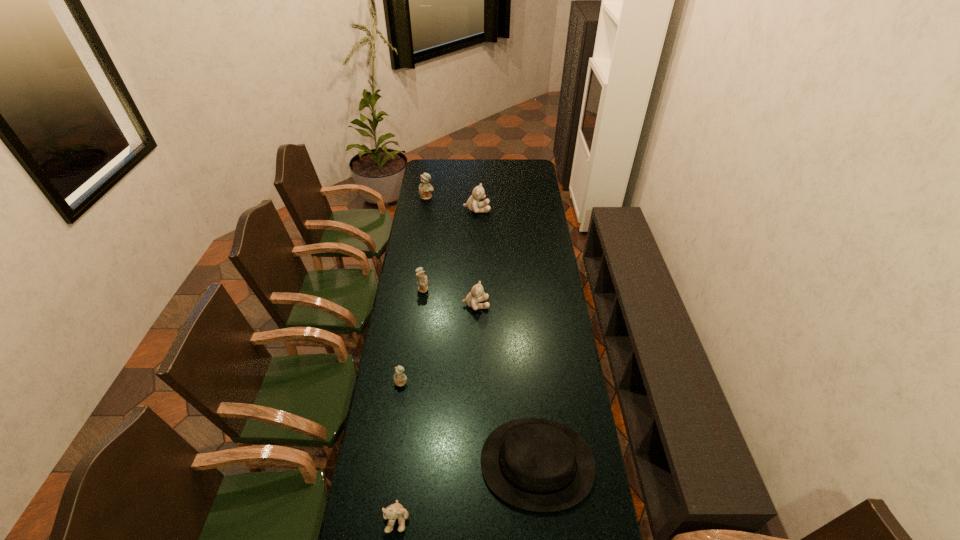
The image size is (960, 540). What are the coordinates of `the farthest blue teddy bear` in the screenshot? It's located at (425, 188).

You are a GUI agent. You are given a task and a screenshot of the screen. Output one action in this format:
    pyautogui.click(x=<x>, y=<y>)
    Task: Click on the biggest blue teddy bear
    This screenshot has width=960, height=540.
    Given the screenshot: What is the action you would take?
    pyautogui.click(x=425, y=188)

At what (x,y) coordinates should I click in order to perform the action: click on the sixth nearest object. Please return your answer as a coordinate pair (x, y). Looking at the image, I should click on (473, 204).

The width and height of the screenshot is (960, 540). Find the location of `the biggest gray teddy bear`. the biggest gray teddy bear is located at coordinates (473, 204).

You are a GUI agent. You are given a task and a screenshot of the screen. Output one action in this format:
    pyautogui.click(x=<x>, y=<y>)
    Task: Click on the third farthest teddy bear
    The image size is (960, 540).
    Given the screenshot: What is the action you would take?
    pyautogui.click(x=422, y=280)

This screenshot has width=960, height=540. I want to click on the second farthest blue teddy bear, so click(x=422, y=280).

Locate an element on the screen. This screenshot has width=960, height=540. the second farthest gray teddy bear is located at coordinates (477, 294).

Where is `the third nearest teddy bear`? The image size is (960, 540). the third nearest teddy bear is located at coordinates (477, 294).

I want to click on fedora, so click(535, 464).

Locate an element on the screen. Image resolution: width=960 pixels, height=540 pixels. the nearest blue teddy bear is located at coordinates pos(400,378).